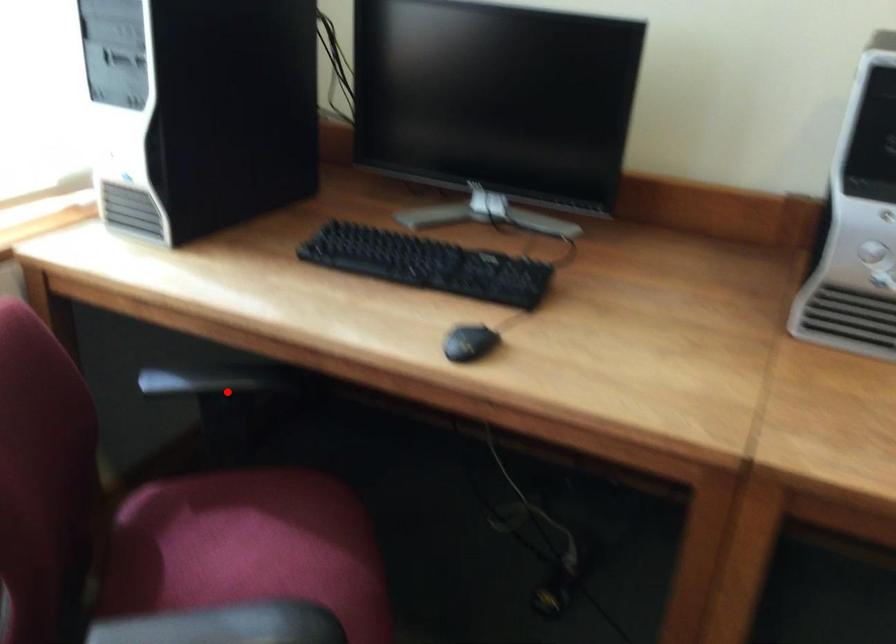
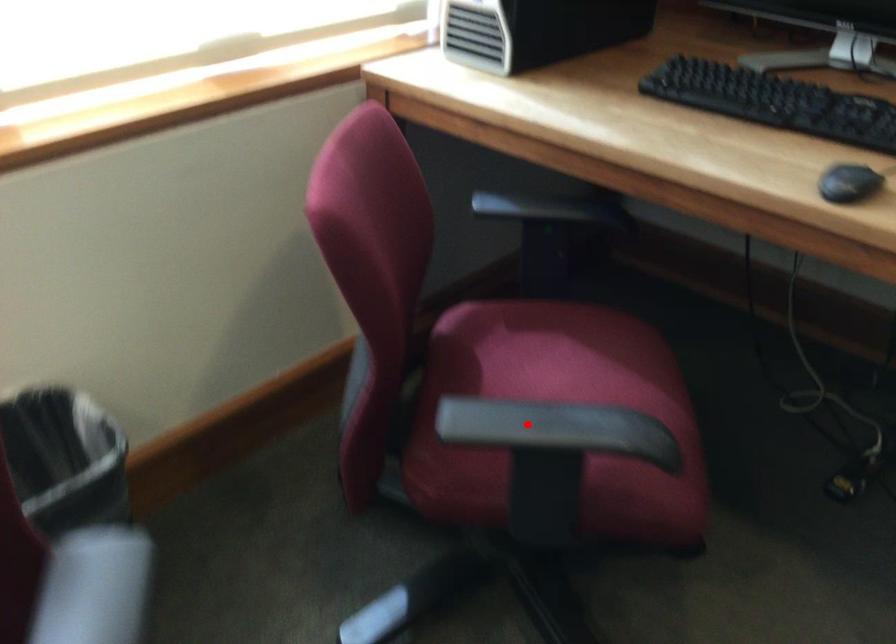
I am providing you with two images of the same scene from different viewpoints. A red point is marked on the first image and another point is marked on the second image. Is the red point in image1 aligned with the point shown in image2?

No